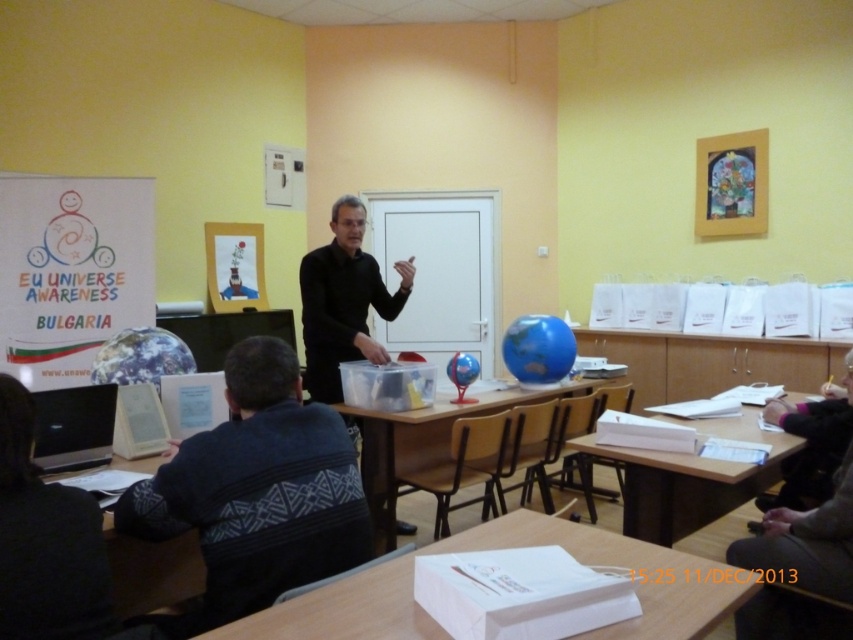
Which is in front, point (637, 573) or point (115, 465)?

Point (637, 573)

Can you confirm if white paper at lower center is positioned to the right of wooden table at lower left?

Indeed, white paper at lower center is positioned on the right side of wooden table at lower left.

Does point (260, 621) come in front of point (183, 589)?

Yes, it is in front of point (183, 589).

This screenshot has height=640, width=853. Find the location of `white paper at lower center`. white paper at lower center is located at coordinates (502, 547).

Where is `dark blue sweater at lower left`? The width and height of the screenshot is (853, 640). dark blue sweater at lower left is located at coordinates (254, 492).

Who is shorter, dark blue sweater at lower left or wooden table at lower right?

wooden table at lower right is shorter.

Between point (282, 362) and point (654, 474), which one is positioned in front?

Point (282, 362) is more forward.

Identify the location of dark blue sweater at lower left. click(x=254, y=492).

Is the position of dark blue sweater at lower left less distant than that of black matte/black shirt at center?

Yes, dark blue sweater at lower left is in front of black matte/black shirt at center.

Can you confirm if dark blue sweater at lower left is positioned to the right of black matte/black shirt at center?

No, dark blue sweater at lower left is not to the right of black matte/black shirt at center.

I want to click on dark blue sweater at lower left, so click(x=254, y=492).

You are a GUI agent. You are given a task and a screenshot of the screen. Output one action in this format:
    pyautogui.click(x=<x>, y=<y>)
    Task: Click on the dark blue sweater at lower left
    This screenshot has width=853, height=640.
    Given the screenshot: What is the action you would take?
    pyautogui.click(x=254, y=492)